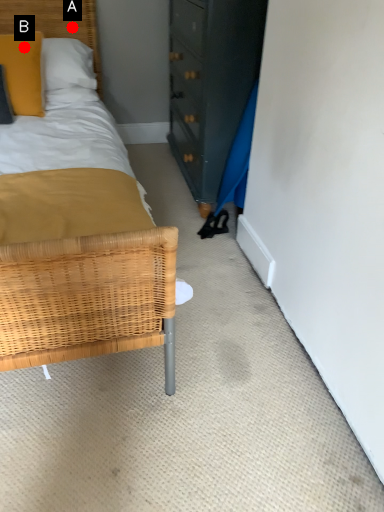
Question: Two points are circled on the image, labeled by A and B beside each circle. Which point is farther to the camera?

Choices:
 (A) A is further
 (B) B is further

Answer: (A)